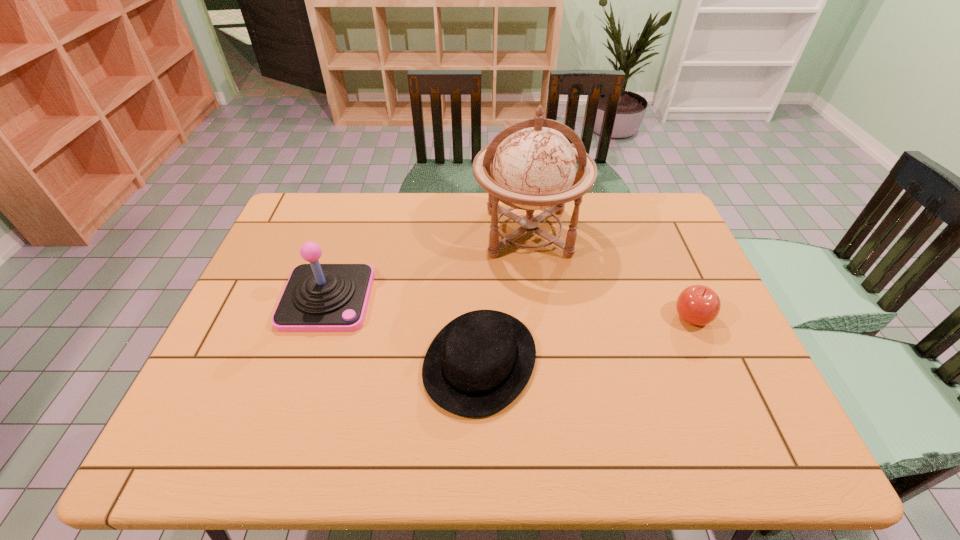
Image resolution: width=960 pixels, height=540 pixels. Identify the location of the closest object to the joystick. (479, 363).

Identify which object is the nearest to the third shortest object. Please provide its 2D coordinates. Your answer should be formatted as a tuple, i.e. [(x, y)], where the tuple contains the x and y coordinates of a point satisfying the conditions above.

[(479, 363)]

In order to click on vacant space that satisfies the following two spatial constraints: 1. forward from the base of the second tallest object; 2. on the right side of the third tallest object in this screenshot , I will do `click(321, 317)`.

At what (x,y) coordinates should I click in order to perform the action: click on vacant area that satisfies the following two spatial constraints: 1. at the front of the rightmost object showing Africa; 2. on the right side of the tallest object. Please return your answer as a coordinate pair (x, y). The width and height of the screenshot is (960, 540). Looking at the image, I should click on (539, 317).

In order to click on free space that satisfies the following two spatial constraints: 1. at the front of the tallest object showing Africa; 2. on the right side of the apple in this screenshot , I will do `click(539, 317)`.

Where is `free space that satisfies the following two spatial constraints: 1. forward from the base of the rightmost object; 2. on the right side of the third shortest object`? free space that satisfies the following two spatial constraints: 1. forward from the base of the rightmost object; 2. on the right side of the third shortest object is located at coordinates (321, 317).

This screenshot has width=960, height=540. Find the location of `vacant area that satisfies the following two spatial constraints: 1. forward from the base of the fedora; 2. on the right side of the third shortest object`. vacant area that satisfies the following two spatial constraints: 1. forward from the base of the fedora; 2. on the right side of the third shortest object is located at coordinates (306, 361).

At what (x,y) coordinates should I click in order to perform the action: click on vacant position in the image that satisfies the following two spatial constraints: 1. on the back side of the apple; 2. on the right side of the shortest object. Please return your answer as a coordinate pair (x, y). Looking at the image, I should click on (480, 317).

The width and height of the screenshot is (960, 540). Find the location of `free point that satisfies the following two spatial constraints: 1. forward from the base of the shortest object; 2. on the right side of the leftmost object`. free point that satisfies the following two spatial constraints: 1. forward from the base of the shortest object; 2. on the right side of the leftmost object is located at coordinates (306, 361).